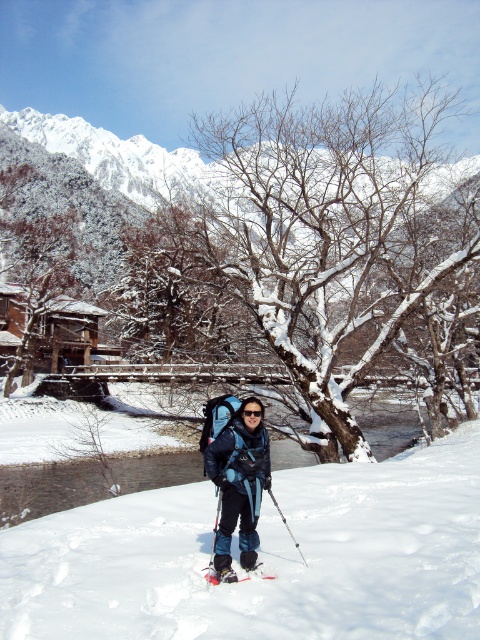
You are planning to take a photo of the white fluffy snow at center and the matte black ski pole at center. Which object would you focus on first if you want to capture both in sharp detail?

The white fluffy snow at center is larger than the matte black ski pole at center, so focusing on the larger object first would ensure both are in sharp detail.

You are a photographer planning to take a winter landscape photo. You want to focus on the white fluffy snow at center. Where exactly should you point your camera to capture it?

You should point your camera to the coordinates point at point (263, 557) to capture the white fluffy snow at center.

You are standing at the base of the snowy slope and want to reach the small wooden structure behind the person. Which direction should you go relative to the matte black ski pole at center and the snowy bark tree at center?

You should go to the left of the matte black ski pole at center because the snowy bark tree at center is to the right of it, so moving left would lead towards the wooden structure behind the person.